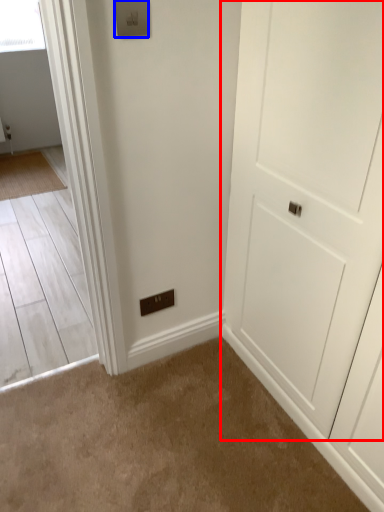
Question: Which object appears farthest to the camera in this image, door (highlighted by a red box) or light switch (highlighted by a blue box)?

Choices:
 (A) door
 (B) light switch

Answer: (B)